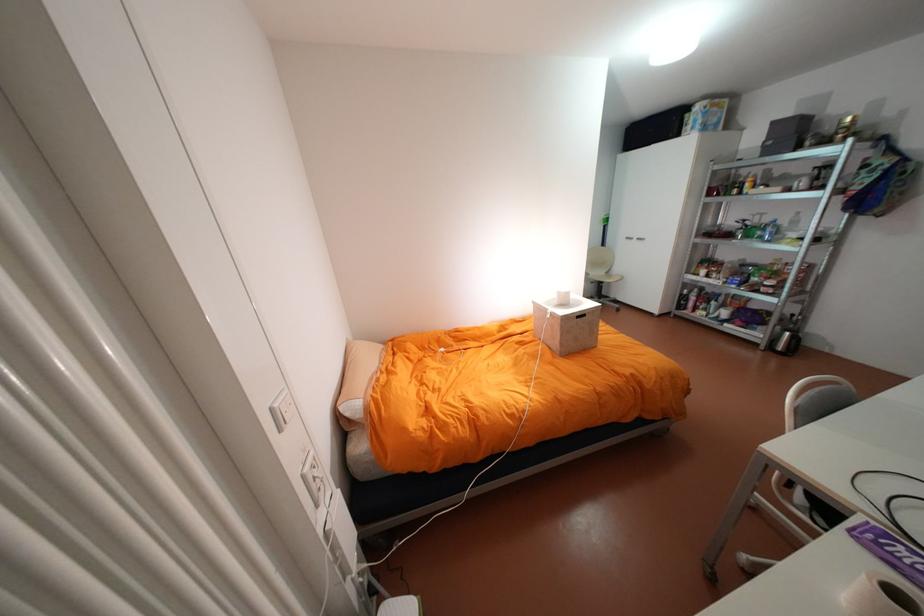
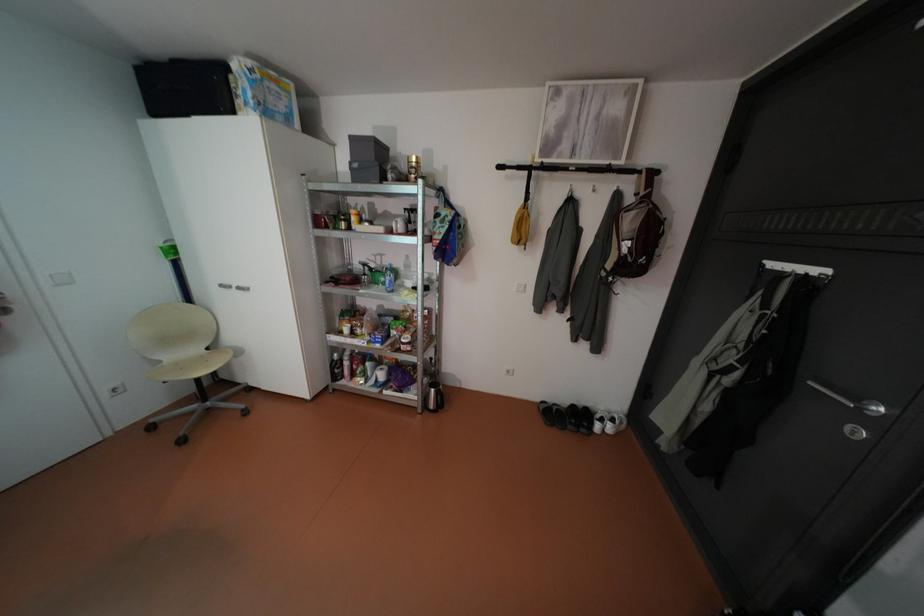
In the second image, find the point that corresponds to point (788, 347) in the first image.

(441, 405)